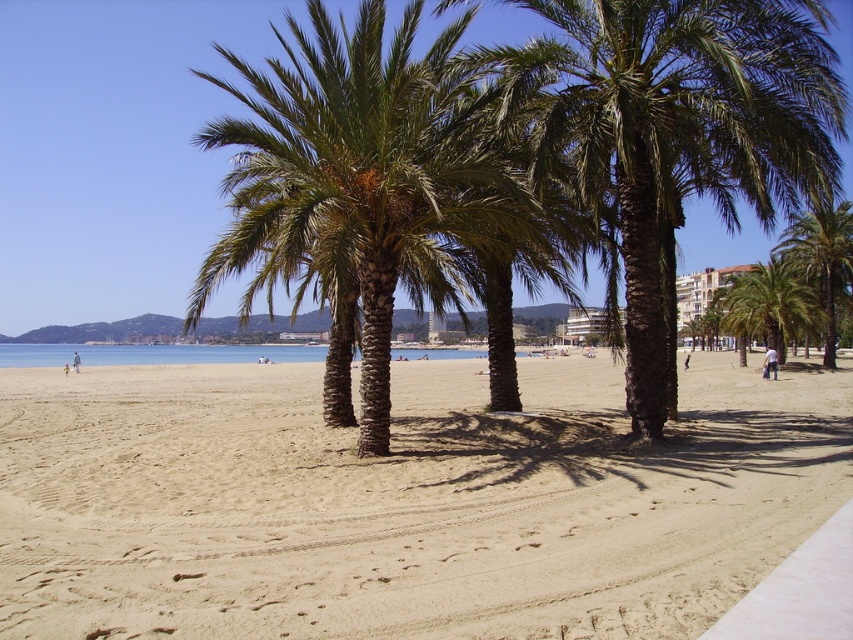
Question: Which object is the farthest from the green-brown textured palm trees at center?

Choices:
 (A) green leafy palm tree at right
 (B) green textured palm tree at right

Answer: (B)

Question: Is beige sandy beach at center behind green textured palm tree at center?

Choices:
 (A) no
 (B) yes

Answer: (A)

Question: Estimate the real-world distances between objects in this image. Which object is closer to the beige sandy beach at center?

Choices:
 (A) green-brown textured palm trees at center
 (B) green textured palm tree at right

Answer: (A)

Question: Which of the following is the closest to the observer?

Choices:
 (A) beige sandy beach at center
 (B) green leafy palm tree at right

Answer: (A)

Question: Is beige sandy beach at center wider than green-brown textured palm trees at center?

Choices:
 (A) yes
 (B) no

Answer: (A)

Question: Is green textured palm tree at center wider than green textured palm tree at right?

Choices:
 (A) no
 (B) yes

Answer: (A)